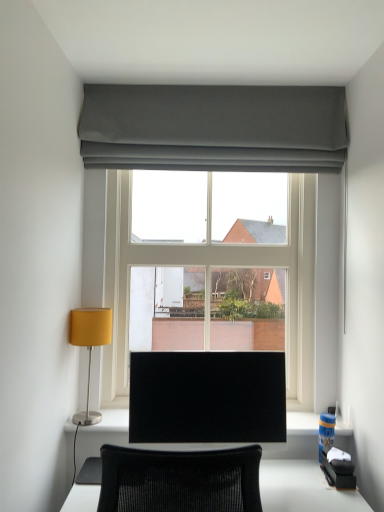
Question: From the image's perspective, is clear glass window at center positioned above or below black glossy monitor at center?

Choices:
 (A) below
 (B) above

Answer: (B)

Question: Is clear glass window at center situated inside black glossy monitor at center or outside?

Choices:
 (A) inside
 (B) outside

Answer: (B)

Question: Which is farther from the matte yellow lampshade at left?

Choices:
 (A) black glossy monitor at center
 (B) dark gray fabric at upper center
 (C) clear glass window at center

Answer: (B)

Question: Estimate the real-world distances between objects in this image. Which object is closer to the clear glass window at center?

Choices:
 (A) dark gray fabric at upper center
 (B) matte yellow lampshade at left
 (C) black glossy monitor at center

Answer: (A)